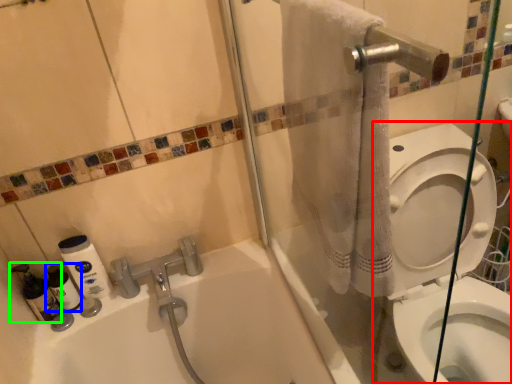
Question: Which is nearer to the toilet (highlighted by a red box)? cleaning product (highlighted by a blue box) or cleaning product (highlighted by a green box).

Choices:
 (A) cleaning product
 (B) cleaning product

Answer: (A)